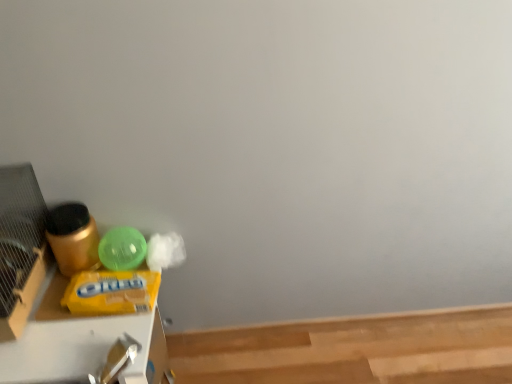
Question: Is light brown smooth wood at lower right surrounded by yellow matte plastic wipes at left?

Choices:
 (A) yes
 (B) no

Answer: (B)

Question: Are yellow matte plastic wipes at left and light brown smooth wood at lower right making contact?

Choices:
 (A) yes
 (B) no

Answer: (B)

Question: From a real-world perspective, is yellow matte plastic wipes at left below light brown smooth wood at lower right?

Choices:
 (A) yes
 (B) no

Answer: (B)

Question: Considering the relative positions of yellow matte plastic wipes at left and light brown smooth wood at lower right in the image provided, is yellow matte plastic wipes at left to the left of light brown smooth wood at lower right from the viewer's perspective?

Choices:
 (A) no
 (B) yes

Answer: (B)

Question: Is yellow matte plastic wipes at left oriented away from light brown smooth wood at lower right?

Choices:
 (A) yes
 (B) no

Answer: (B)

Question: From the image's perspective, is yellow matte plastic wipes at left below light brown smooth wood at lower right?

Choices:
 (A) yes
 (B) no

Answer: (B)

Question: Is light brown smooth wood at lower right to the left of yellow matte plastic wipes at left from the viewer's perspective?

Choices:
 (A) no
 (B) yes

Answer: (A)

Question: Is light brown smooth wood at lower right positioned with its back to yellow matte plastic wipes at left?

Choices:
 (A) no
 (B) yes

Answer: (A)

Question: Is light brown smooth wood at lower right shorter than yellow matte plastic wipes at left?

Choices:
 (A) yes
 (B) no

Answer: (A)

Question: Is light brown smooth wood at lower right bigger than yellow matte plastic wipes at left?

Choices:
 (A) yes
 (B) no

Answer: (B)

Question: Is the depth of light brown smooth wood at lower right less than that of yellow matte plastic wipes at left?

Choices:
 (A) yes
 (B) no

Answer: (B)

Question: Is light brown smooth wood at lower right behind yellow matte plastic wipes at left?

Choices:
 (A) no
 (B) yes

Answer: (B)

Question: Is point (190, 342) positioned closer to the camera than point (45, 379)?

Choices:
 (A) farther
 (B) closer

Answer: (A)